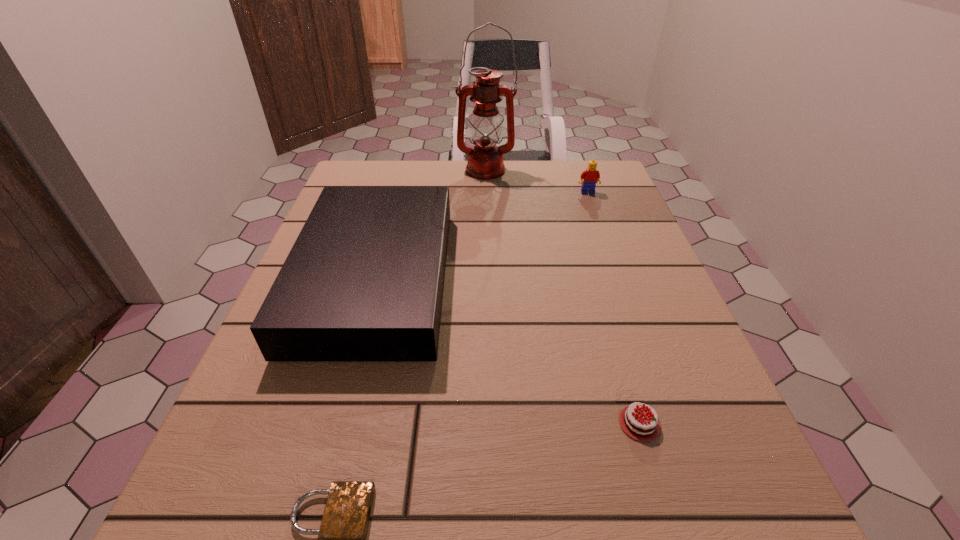
Where is `vacant space that satisfies the following two spatial constraints: 1. at the front of the second nearest object for disc insertion; 2. on the right side of the third farthest object`? The width and height of the screenshot is (960, 540). vacant space that satisfies the following two spatial constraints: 1. at the front of the second nearest object for disc insertion; 2. on the right side of the third farthest object is located at coordinates (336, 423).

Where is `vacant area that satisfies the following two spatial constraints: 1. at the front of the CD player for disc insertion; 2. on the left side of the chocolate cake`? The image size is (960, 540). vacant area that satisfies the following two spatial constraints: 1. at the front of the CD player for disc insertion; 2. on the left side of the chocolate cake is located at coordinates (336, 423).